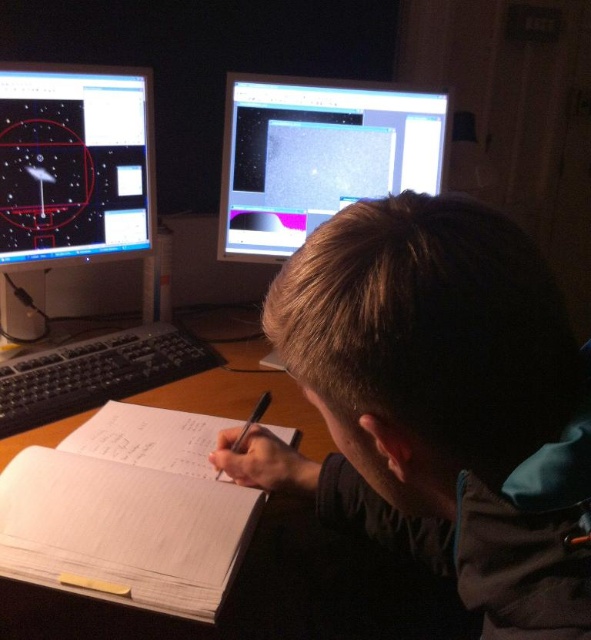
Question: Does matte black monitor at upper center have a greater width compared to white paper at center?

Choices:
 (A) yes
 (B) no

Answer: (A)

Question: Which object appears closest to the camera in this image?

Choices:
 (A) matte black monitor at upper left
 (B) black plastic keyboard at center

Answer: (B)

Question: Which object is positioned closest to the yellow paper at lower left?

Choices:
 (A) matte black monitor at upper left
 (B) brown hair at center
 (C) white paper at center
 (D) black plastic keyboard at center

Answer: (C)

Question: Can you confirm if brown hair at center is positioned to the left of matte black monitor at upper center?

Choices:
 (A) no
 (B) yes

Answer: (A)

Question: Does white paper at center have a smaller size compared to yellow paper at lower left?

Choices:
 (A) no
 (B) yes

Answer: (A)

Question: Estimate the real-world distances between objects in this image. Which object is closer to the yellow paper at lower left?

Choices:
 (A) black plastic keyboard at center
 (B) matte black monitor at upper left
 (C) white paper at center

Answer: (C)